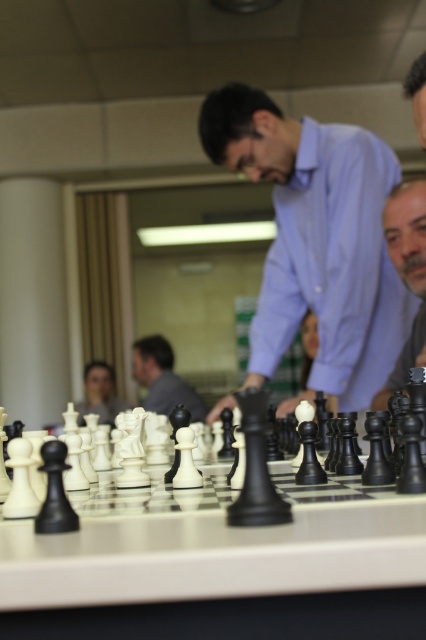
Does point (276, 294) come closer to viewer compared to point (132, 362)?

Yes.

Between point (319, 141) and point (196, 401), which one is positioned in front?

Point (319, 141) is in front.

At what (x,y) coordinates should I click in order to perform the action: click on matte blue shirt at center. Please return your answer as a coordinate pair (x, y). The image size is (426, 640). Looking at the image, I should click on (316, 243).

Locate an element on the screen. The width and height of the screenshot is (426, 640). matte blue shirt at center is located at coordinates coord(316,243).

Which is more to the right, matte blue shirt at center or smooth black chess piece at right?

From the viewer's perspective, smooth black chess piece at right appears more on the right side.

The height and width of the screenshot is (640, 426). Find the location of `matte blue shirt at center`. matte blue shirt at center is located at coordinates (316, 243).

Based on the photo, who is positioned more to the right, smooth black chess piece at right or matte black chess piece at center?

smooth black chess piece at right is more to the right.

Which is more to the left, smooth black chess piece at right or matte black chess piece at center?

matte black chess piece at center is more to the left.

Where is `smooth black chess piece at right`? smooth black chess piece at right is located at coordinates (406, 273).